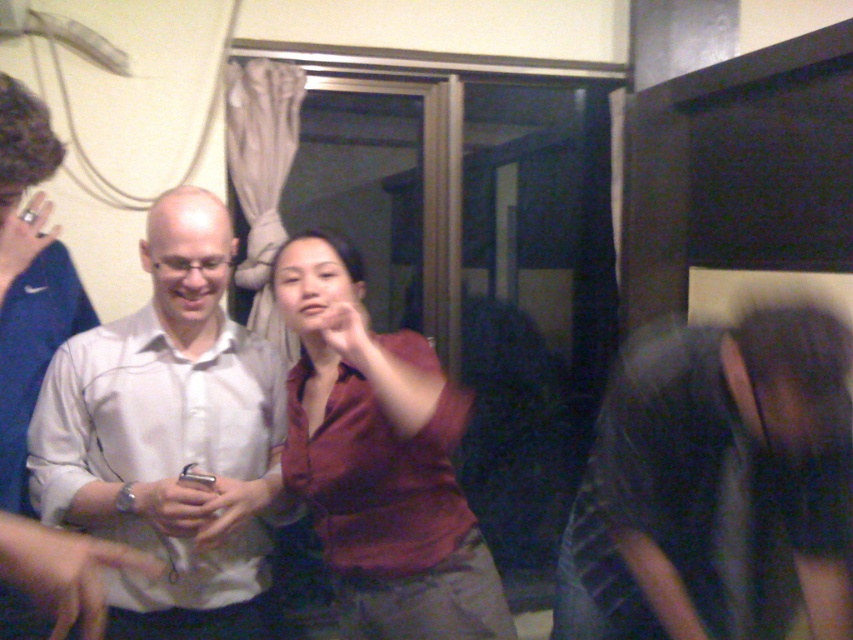
Question: Is white matte shirt at center positioned behind matte red shirt at center?

Choices:
 (A) no
 (B) yes

Answer: (B)

Question: Is dark blue jeans at lower right wider than matte red shirt at center?

Choices:
 (A) no
 (B) yes

Answer: (B)

Question: Is white matte shirt at center below matte red shirt at center?

Choices:
 (A) no
 (B) yes

Answer: (A)

Question: Which point appears closest to the camera in this image?

Choices:
 (A) (352, 257)
 (B) (247, 531)
 (C) (662, 637)

Answer: (C)

Question: Which of the following is the closest to the observer?

Choices:
 (A) (363, 564)
 (B) (819, 531)
 (C) (132, 324)

Answer: (B)

Question: Which point is farther from the camera taking this photo?

Choices:
 (A) (427, 554)
 (B) (236, 538)

Answer: (B)